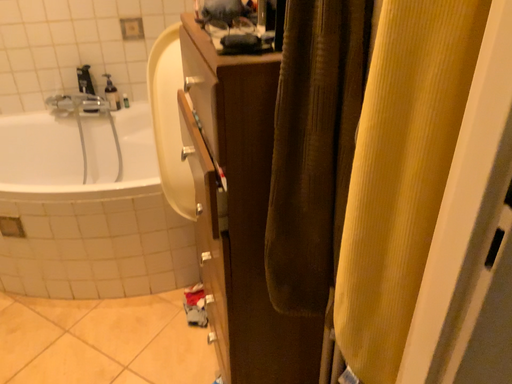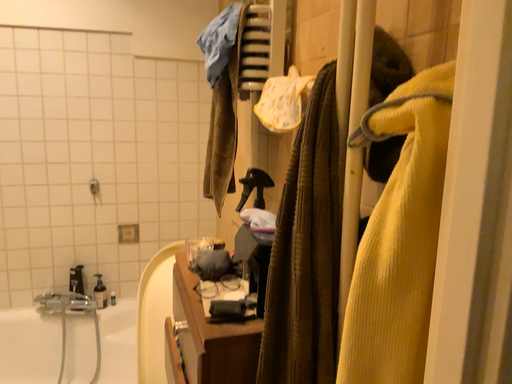
Question: How did the camera likely rotate when shooting the video?

Choices:
 (A) rotated downward
 (B) rotated upward

Answer: (B)